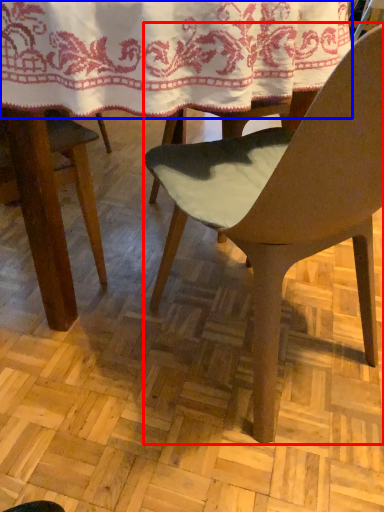
Question: Which object is closer to the camera taking this photo, chair (highlighted by a red box) or blanket (highlighted by a blue box)?

Choices:
 (A) chair
 (B) blanket

Answer: (A)